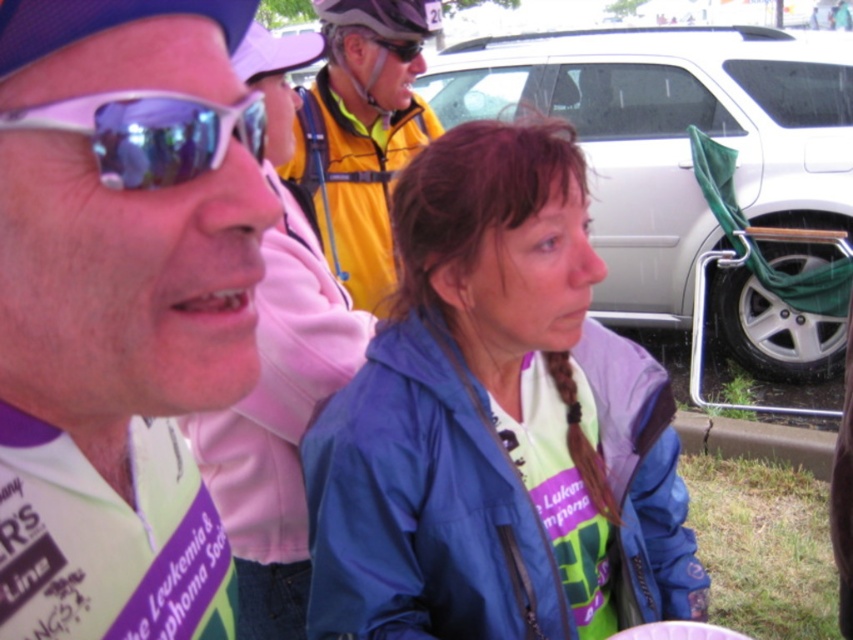
Question: Observing the image, what is the correct spatial positioning of shiny black helmet at upper center in reference to white paper plate at center?

Choices:
 (A) above
 (B) below

Answer: (A)

Question: Which of the following is the farthest from the observer?

Choices:
 (A) sunglasses at center
 (B) blue fabric jacket at center
 (C) shiny purple plastic sunglasses at upper left
 (D) yellow jacket at upper center

Answer: (A)

Question: Is shiny purple plastic sunglasses at upper left below matte yellow helmet at upper center?

Choices:
 (A) yes
 (B) no

Answer: (A)

Question: Among these points, which one is farthest from the camera?

Choices:
 (A) (428, 115)
 (B) (403, 52)
 (C) (439, 467)

Answer: (A)

Question: Which is nearer to the white paper plate at center?

Choices:
 (A) shiny black helmet at upper center
 (B) sunglasses at center
 (C) yellow jacket at upper center

Answer: (C)

Question: Is shiny purple plastic sunglasses at upper left further to camera compared to sunglasses at center?

Choices:
 (A) no
 (B) yes

Answer: (A)